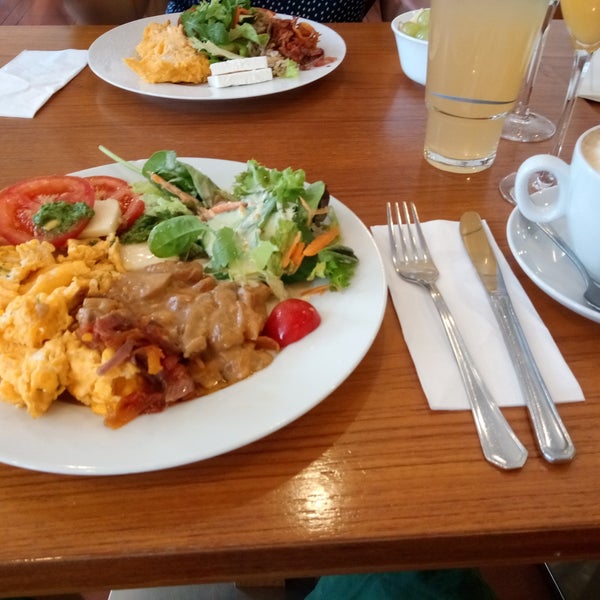
The width and height of the screenshot is (600, 600). In order to click on glass in this screenshot , I will do `click(480, 41)`, `click(537, 48)`, `click(584, 28)`.